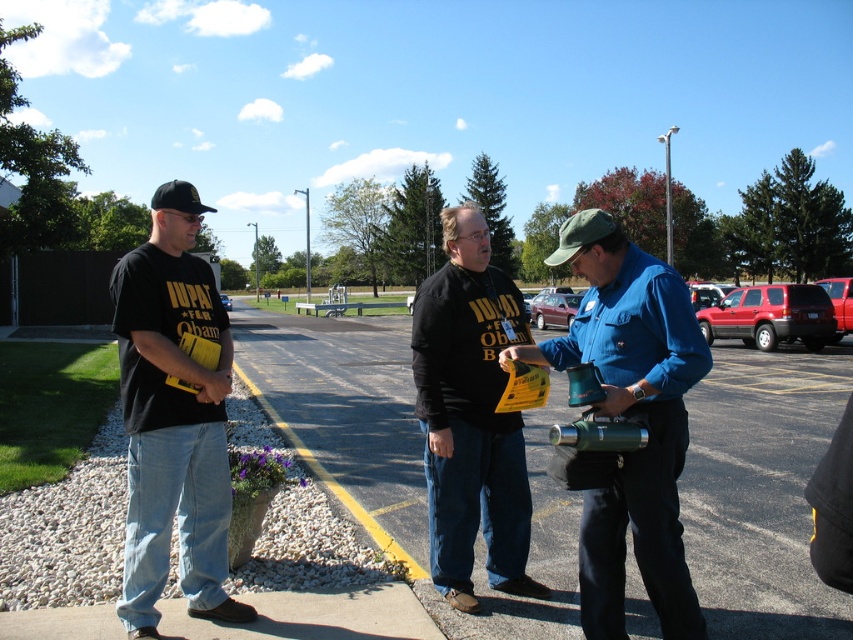
Question: Can you confirm if black matte t-shirt at left is positioned to the right of black matte shirt at center?

Choices:
 (A) no
 (B) yes

Answer: (A)

Question: Does asphalt pavement at center appear under black matte t-shirt at left?

Choices:
 (A) no
 (B) yes

Answer: (B)

Question: Estimate the real-world distances between objects in this image. Which object is farther from the black matte shirt at center?

Choices:
 (A) metallic green canister at center
 (B) asphalt pavement at center

Answer: (B)

Question: Which of these objects is positioned closest to the black matte shirt at center?

Choices:
 (A) asphalt pavement at center
 (B) black matte t-shirt at left

Answer: (B)

Question: Which of the following is the farthest from the observer?

Choices:
 (A) (695, 634)
 (B) (415, 298)

Answer: (B)

Question: Can you confirm if asphalt pavement at center is positioned below black matte t-shirt at left?

Choices:
 (A) no
 (B) yes

Answer: (B)